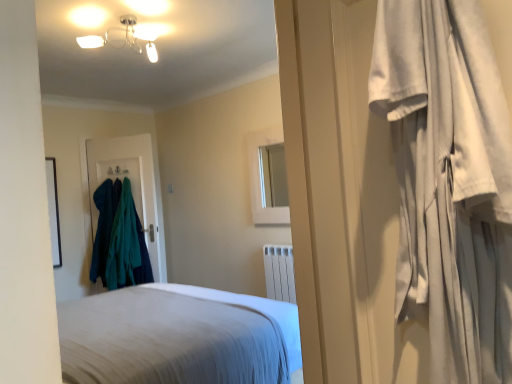
Question: Is point (120, 322) closer or farther from the camera than point (105, 31)?

Choices:
 (A) closer
 (B) farther

Answer: (A)

Question: Is white soft bed at center, acting as the first bed starting from the top, spatially inside metallic glass chandelier at upper center, or outside of it?

Choices:
 (A) outside
 (B) inside

Answer: (A)

Question: Which of these objects is positioned closest to the white soft bed at center, acting as the first bed starting from the top?

Choices:
 (A) white glossy medicine cabinet at upper center
 (B) teal fabric coat at left, the 2th clothing viewed from the right
 (C) teal woolen sweater at left, acting as the 2th clothing starting from the left
 (D) white cotton curtain at right
 (E) metallic glass chandelier at upper center

Answer: (D)

Question: Which object is the closest to the teal fabric coat hanger at left?

Choices:
 (A) white soft bed at center, the 1th bed positioned from the front
 (B) metallic glass chandelier at upper center
 (C) white glossy medicine cabinet at upper center
 (D) green fabric hanger at upper left
 (E) white soft bed at center, the first bed when ordered from back to front

Answer: (D)